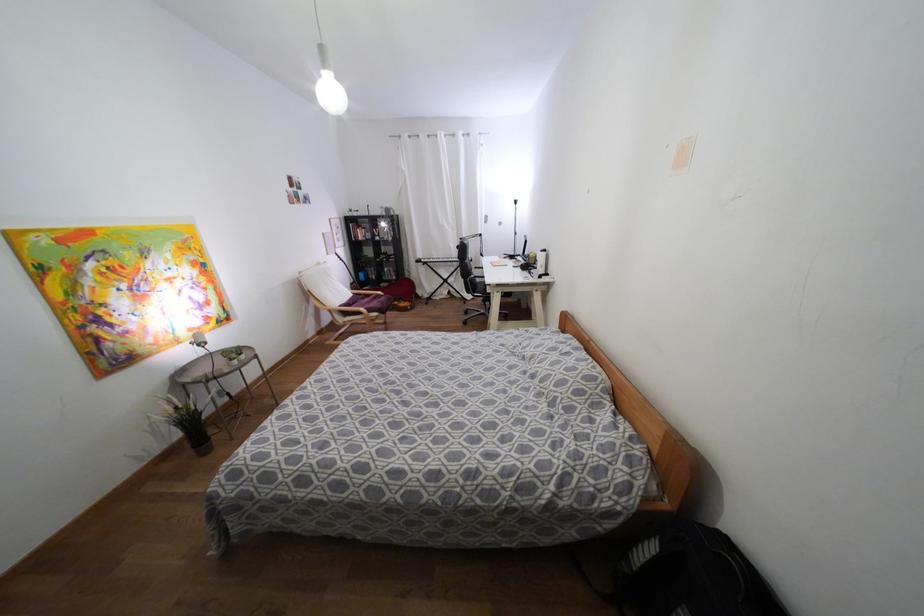
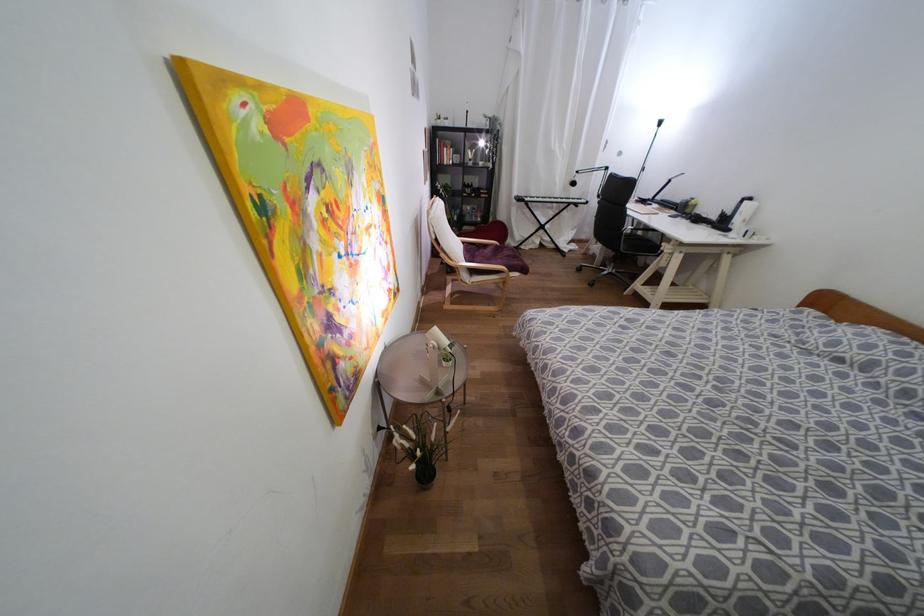
What movement of the cameraman would produce the second image?

The movement direction of the cameraman is left, forward.